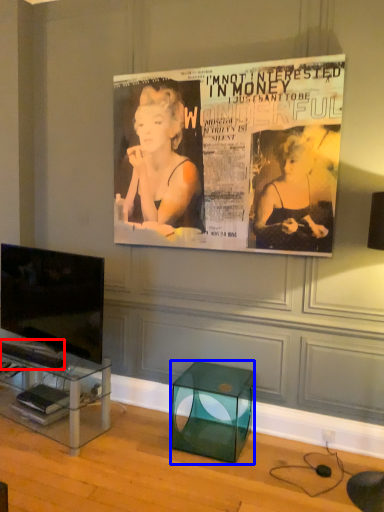
Question: Which of the following is the closest to the observer, magazine (highlighted by a red box) or glass box (highlighted by a blue box)?

Choices:
 (A) magazine
 (B) glass box

Answer: (B)